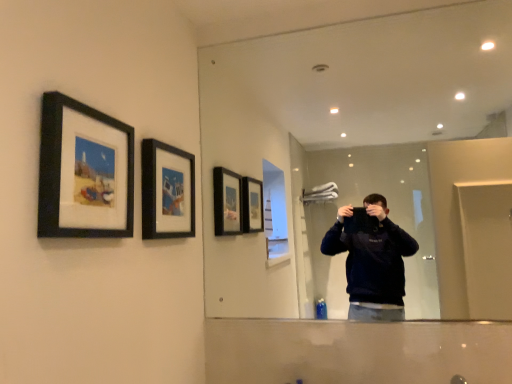
Question: From the image's perspective, does clear glass mirror at upper center appear lower than black matte picture frame at upper center, marked as the first picture frame in a right-to-left arrangement?

Choices:
 (A) yes
 (B) no

Answer: (B)

Question: Is clear glass mirror at upper center to the left of black matte picture frame at upper center, the first picture frame positioned from the back, from the viewer's perspective?

Choices:
 (A) no
 (B) yes

Answer: (A)

Question: Is clear glass mirror at upper center oriented towards black matte picture frame at upper center, marked as the first picture frame in a right-to-left arrangement?

Choices:
 (A) no
 (B) yes

Answer: (B)

Question: Is clear glass mirror at upper center far away from black matte picture frame at upper center, marked as the first picture frame in a right-to-left arrangement?

Choices:
 (A) no
 (B) yes

Answer: (B)

Question: Is the position of clear glass mirror at upper center less distant than that of black matte picture frame at upper center, which ranks as the 2th picture frame in left-to-right order?

Choices:
 (A) no
 (B) yes

Answer: (A)

Question: Is point (287, 72) closer or farther from the camera than point (192, 180)?

Choices:
 (A) closer
 (B) farther

Answer: (B)

Question: Is clear glass mirror at upper center in front of or behind black matte picture frame at upper center, marked as the first picture frame in a right-to-left arrangement, in the image?

Choices:
 (A) behind
 (B) front

Answer: (A)

Question: From the image's perspective, relative to black matte picture frame at upper center, which is counted as the second picture frame, starting from the front, is clear glass mirror at upper center above or below?

Choices:
 (A) below
 (B) above

Answer: (B)

Question: Is clear glass mirror at upper center inside the boundaries of black matte picture frame at upper center, the first picture frame positioned from the back, or outside?

Choices:
 (A) outside
 (B) inside

Answer: (A)

Question: From a real-world perspective, is clear glass mirror at upper center above or below black matte picture frame at upper left, which is counted as the 1th picture frame, starting from the front?

Choices:
 (A) above
 (B) below

Answer: (A)

Question: Considering the positions of point (243, 148) and point (129, 165), is point (243, 148) closer or farther from the camera than point (129, 165)?

Choices:
 (A) farther
 (B) closer

Answer: (A)

Question: Is clear glass mirror at upper center in front of or behind black matte picture frame at upper left, which is counted as the 1th picture frame, starting from the front, in the image?

Choices:
 (A) behind
 (B) front

Answer: (A)

Question: Is clear glass mirror at upper center situated inside black matte picture frame at upper left, which is counted as the 1th picture frame, starting from the front, or outside?

Choices:
 (A) outside
 (B) inside

Answer: (A)

Question: Is black matte picture frame at upper left, arranged as the second picture frame when viewed from the right, taller or shorter than clear glass mirror at upper center?

Choices:
 (A) tall
 (B) short

Answer: (B)

Question: Is point (84, 140) positioned closer to the camera than point (347, 46)?

Choices:
 (A) closer
 (B) farther

Answer: (A)